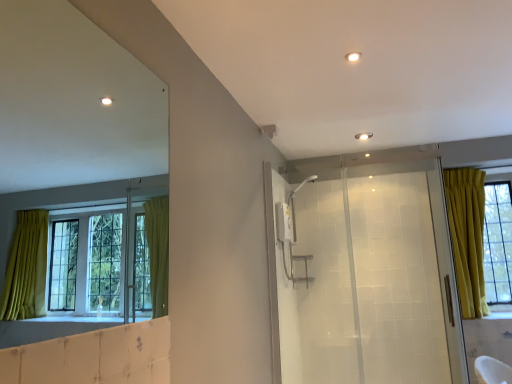
Question: Is transparent glass shower door at center outside white glossy light at upper center?

Choices:
 (A) no
 (B) yes

Answer: (B)

Question: From the image's perspective, would you say transparent glass shower door at center is shown under white glossy light at upper center?

Choices:
 (A) no
 (B) yes

Answer: (B)

Question: Can you confirm if transparent glass shower door at center is bigger than white glossy light at upper center?

Choices:
 (A) no
 (B) yes

Answer: (B)

Question: Would you consider transparent glass shower door at center to be distant from white glossy light at upper center?

Choices:
 (A) no
 (B) yes

Answer: (B)

Question: Is transparent glass shower door at center oriented away from white glossy light at upper center?

Choices:
 (A) no
 (B) yes

Answer: (A)

Question: Is transparent glass shower door at center taller than white glossy light at upper center?

Choices:
 (A) yes
 (B) no

Answer: (A)

Question: Is white glossy light at upper center facing towards transparent glass shower door at center?

Choices:
 (A) yes
 (B) no

Answer: (B)

Question: From a real-world perspective, does white glossy light at upper center stand above transparent glass shower door at center?

Choices:
 (A) no
 (B) yes

Answer: (B)

Question: Could transparent glass shower door at center be considered to be inside white glossy light at upper center?

Choices:
 (A) yes
 (B) no

Answer: (B)

Question: Would you say white glossy light at upper center is a long distance from transparent glass shower door at center?

Choices:
 (A) no
 (B) yes

Answer: (B)

Question: From the image's perspective, is white glossy light at upper center below transparent glass shower door at center?

Choices:
 (A) yes
 (B) no

Answer: (B)

Question: Does white glossy light at upper center lie in front of transparent glass shower door at center?

Choices:
 (A) yes
 (B) no

Answer: (A)

Question: Is transparent glass shower door at center taller or shorter than white glossy light at upper center?

Choices:
 (A) short
 (B) tall

Answer: (B)